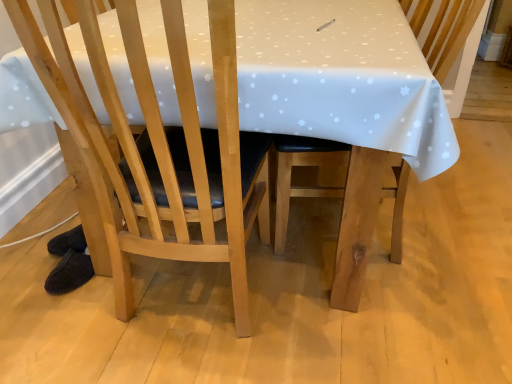
Question: Is light wood chair at center, marked as the second chair in a right-to-left arrangement, wider than wooden chair at center, acting as the second chair starting from the left?

Choices:
 (A) yes
 (B) no

Answer: (B)

Question: Is the surface of light wood chair at center, marked as the second chair in a right-to-left arrangement, in direct contact with wooden chair at center, the first chair when ordered from right to left?

Choices:
 (A) yes
 (B) no

Answer: (B)

Question: Is wooden chair at center, acting as the second chair starting from the left, surrounded by light wood chair at center, marked as the 1th chair in a left-to-right arrangement?

Choices:
 (A) yes
 (B) no

Answer: (B)

Question: Can you confirm if light wood chair at center, marked as the 1th chair in a left-to-right arrangement, is positioned to the left of wooden chair at center, the first chair when ordered from right to left?

Choices:
 (A) no
 (B) yes

Answer: (B)

Question: Does light wood chair at center, marked as the second chair in a right-to-left arrangement, have a lesser height compared to wooden chair at center, the first chair when ordered from right to left?

Choices:
 (A) yes
 (B) no

Answer: (B)

Question: Is light wood chair at center, marked as the 1th chair in a left-to-right arrangement, not inside wooden chair at center, acting as the second chair starting from the left?

Choices:
 (A) yes
 (B) no

Answer: (A)

Question: From a real-world perspective, is wooden chair at center, acting as the second chair starting from the left, on light wood chair at center, marked as the 1th chair in a left-to-right arrangement?

Choices:
 (A) no
 (B) yes

Answer: (A)

Question: Is wooden chair at center, acting as the second chair starting from the left, looking in the opposite direction of light wood chair at center, marked as the second chair in a right-to-left arrangement?

Choices:
 (A) no
 (B) yes

Answer: (A)

Question: Can you confirm if wooden chair at center, the first chair when ordered from right to left, is wider than light wood chair at center, marked as the 1th chair in a left-to-right arrangement?

Choices:
 (A) no
 (B) yes

Answer: (B)

Question: Is wooden chair at center, the first chair when ordered from right to left, taller than light wood chair at center, marked as the second chair in a right-to-left arrangement?

Choices:
 (A) no
 (B) yes

Answer: (A)

Question: Considering the relative sizes of wooden chair at center, the first chair when ordered from right to left, and light wood chair at center, marked as the 1th chair in a left-to-right arrangement, in the image provided, is wooden chair at center, the first chair when ordered from right to left, shorter than light wood chair at center, marked as the 1th chair in a left-to-right arrangement,?

Choices:
 (A) no
 (B) yes

Answer: (B)

Question: Is wooden chair at center, the first chair when ordered from right to left, bigger than light wood chair at center, marked as the second chair in a right-to-left arrangement?

Choices:
 (A) yes
 (B) no

Answer: (A)

Question: From the image's perspective, is light wood chair at center, marked as the 1th chair in a left-to-right arrangement, located above or below wooden chair at center, acting as the second chair starting from the left?

Choices:
 (A) above
 (B) below

Answer: (B)